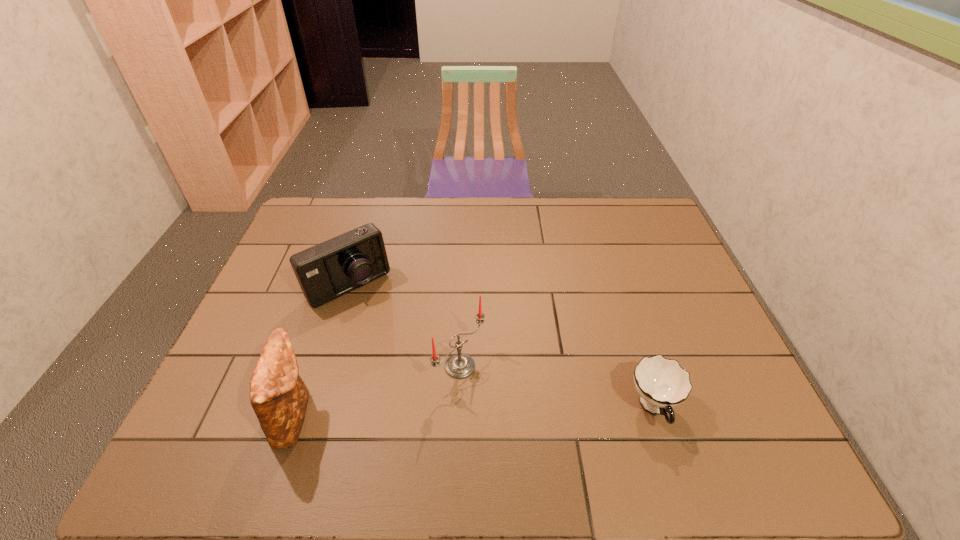
This screenshot has height=540, width=960. I want to click on free location located on the front-facing side of the candle, so click(x=540, y=421).

Image resolution: width=960 pixels, height=540 pixels. I want to click on clutch bag situated at the near edge, so click(x=279, y=397).

You are a GUI agent. You are given a task and a screenshot of the screen. Output one action in this format:
    pyautogui.click(x=<x>, y=<y>)
    Task: Click on the cup that is at the near edge
    
    Given the screenshot: What is the action you would take?
    pyautogui.click(x=662, y=383)

Image resolution: width=960 pixels, height=540 pixels. Find the location of `candle positioned at the near edge`. candle positioned at the near edge is located at coordinates click(x=459, y=365).

In order to click on object positioned at the left edge in this screenshot , I will do `click(326, 271)`.

The image size is (960, 540). In the image, there is a desktop. In order to click on free space at the far edge in this screenshot , I will do `click(502, 199)`.

Locate an element on the screen. The width and height of the screenshot is (960, 540). vacant position at the near edge of the desktop is located at coordinates (561, 395).

In the image, there is a desktop. At what (x,y) coordinates should I click in order to perform the action: click on vacant space at the left edge. Please return your answer as a coordinate pair (x, y). Looking at the image, I should click on (243, 332).

Locate an element on the screen. vacant region at the right edge of the desktop is located at coordinates (682, 348).

At what (x,y) coordinates should I click in order to perform the action: click on vacant area at the far left corner of the desktop. Please return your answer as a coordinate pair (x, y). The width and height of the screenshot is (960, 540). Looking at the image, I should click on (314, 218).